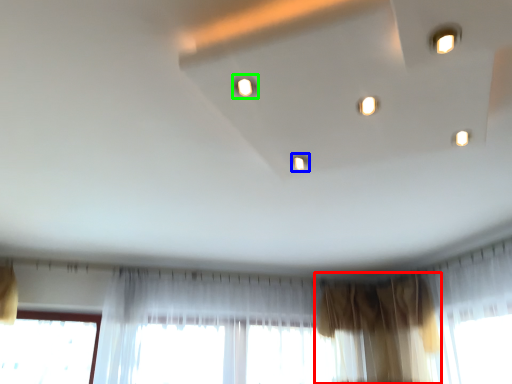
Question: Based on their relative distances, which object is nearer to curtain (highlighted by a red box)? Choose from light (highlighted by a blue box) and light (highlighted by a green box).

Choices:
 (A) light
 (B) light

Answer: (A)